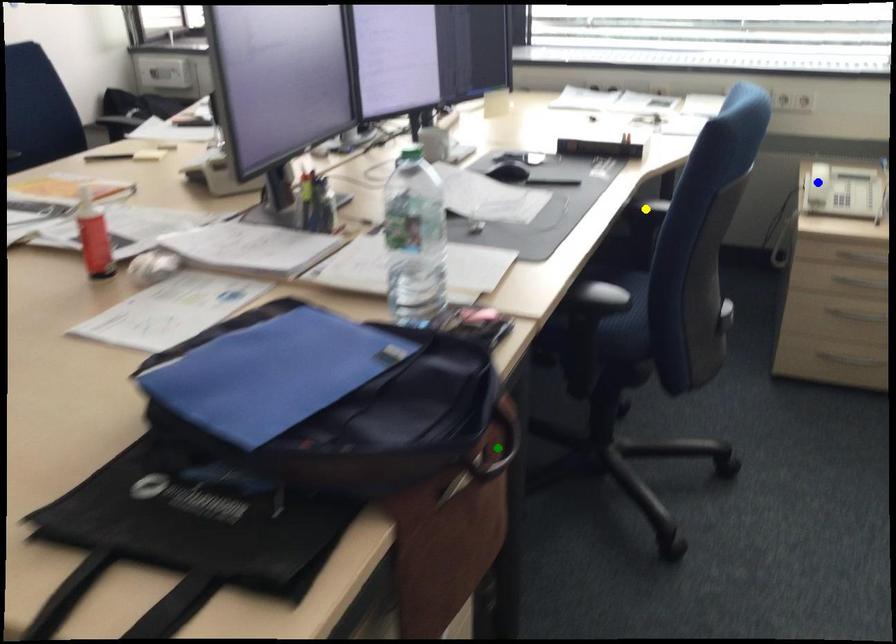
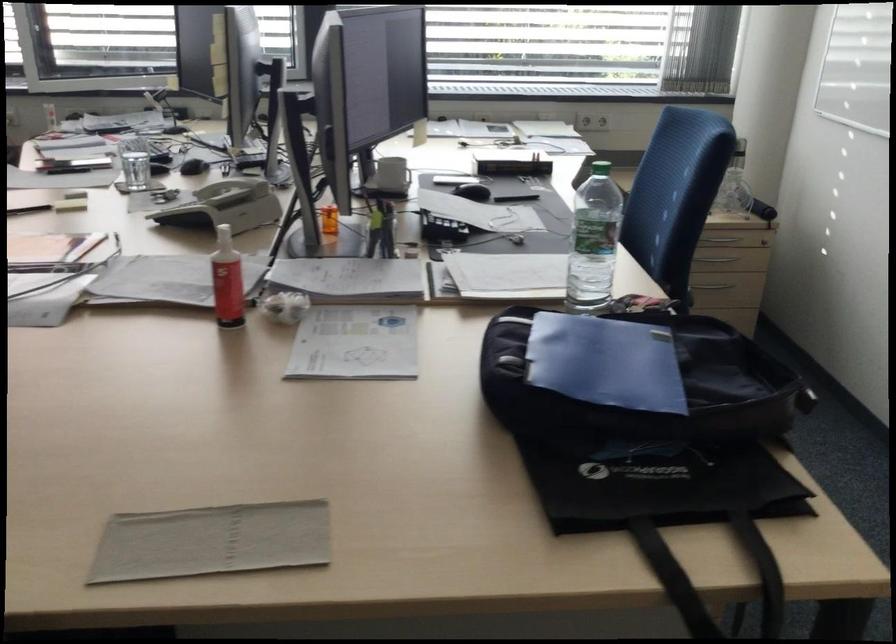
I am providing you with two images of the same scene from different viewpoints. Three points are marked in image1. Which point corresponds to a part or object that is occluded in image2?In image1, three points are marked. Which of them correspond to a part or object that is occluded in image2?Among the three points shown in image1, which one corresponds to a part or object that is no longer visible due to occlusion in image2?

Invisible in image2: blue point, yellow point, green point.